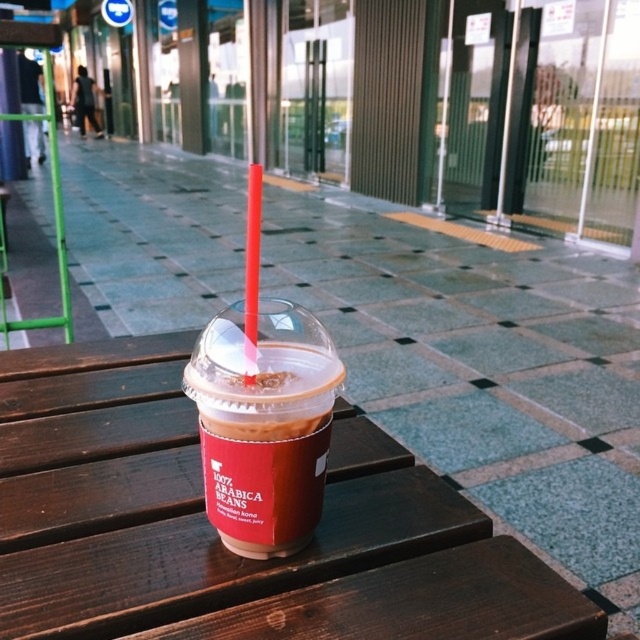
Which of these two, brown wooden picnic table at center or matte plastic cup at center, stands taller?

Standing taller between the two is brown wooden picnic table at center.

Is brown wooden picnic table at center to the left of matte plastic cup at center from the viewer's perspective?

Correct, you'll find brown wooden picnic table at center to the left of matte plastic cup at center.

Is point (204, 593) positioned before point (282, 380)?

No, (204, 593) is behind (282, 380).

What are the coordinates of `brown wooden picnic table at center` in the screenshot? It's located at (216, 536).